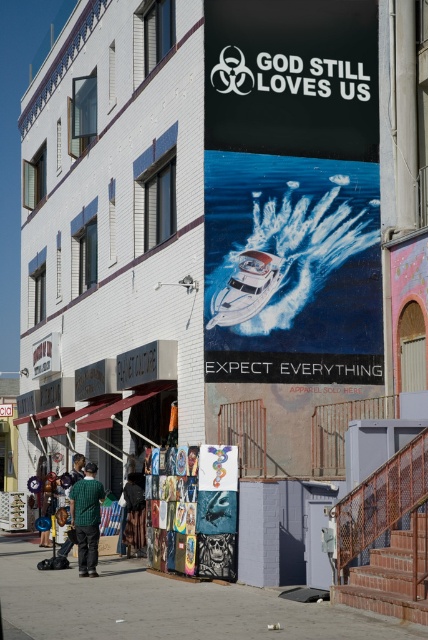
Between matte black signboard at upper center and white glossy boat at center, which one has less height?

matte black signboard at upper center is shorter.

Is matte black signboard at upper center shorter than white glossy boat at center?

Yes.

Does point (305, 156) lie in front of point (228, 280)?

No, (305, 156) is further to viewer.

This screenshot has width=428, height=640. Identify the location of matte black signboard at upper center. (291, 192).

I want to click on matte black signboard at upper center, so click(291, 192).

Where is `matte black signboard at upper center`? The image size is (428, 640). matte black signboard at upper center is located at coordinates (291, 192).

Who is positioned more to the right, metallic silver paintings at center or green checkered shirt at lower left?

From the viewer's perspective, metallic silver paintings at center appears more on the right side.

Does metallic silver paintings at center have a larger size compared to green checkered shirt at lower left?

Indeed, metallic silver paintings at center has a larger size compared to green checkered shirt at lower left.

Locate an element on the screen. The height and width of the screenshot is (640, 428). metallic silver paintings at center is located at coordinates (211, 515).